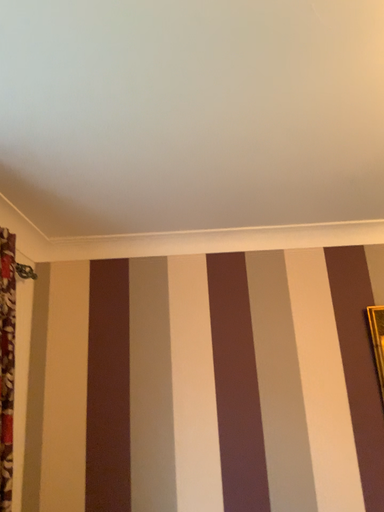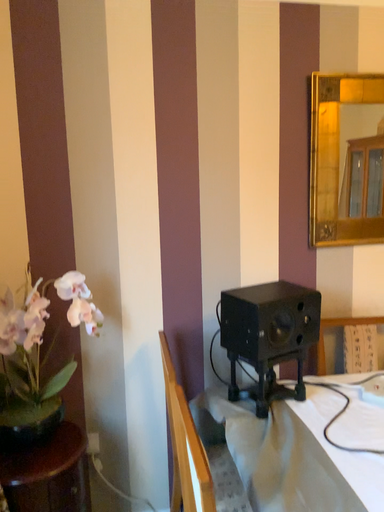
Question: How did the camera likely rotate when shooting the video?

Choices:
 (A) rotated right
 (B) rotated left

Answer: (A)